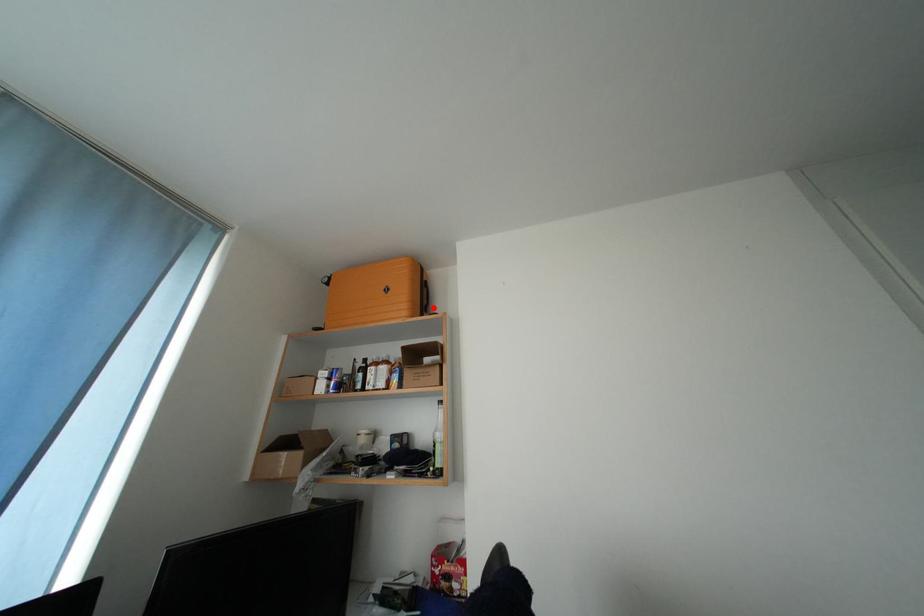
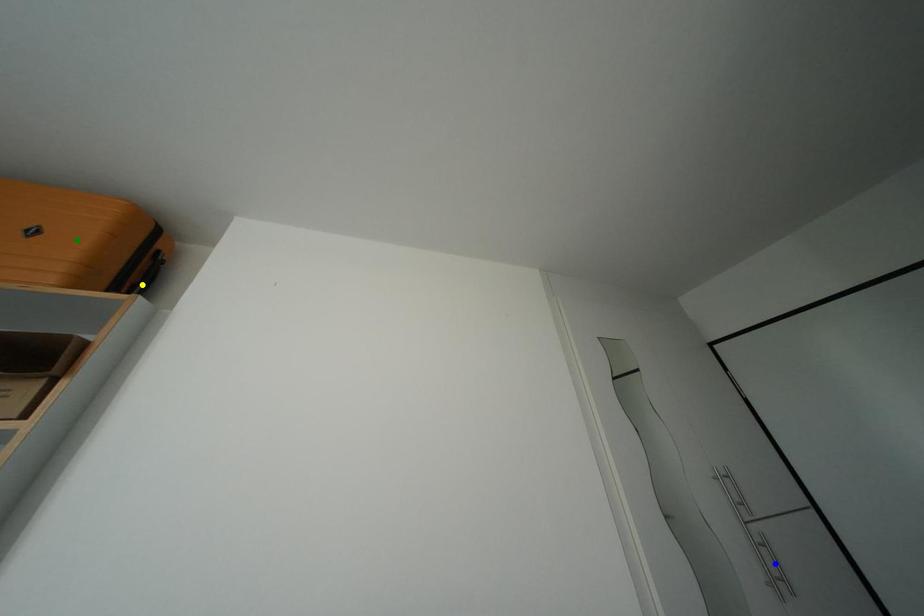
Question: I am providing you with two images of the same scene from different viewpoints. A red point is marked on the first image. You are given multiple points on the second image. Can you choose the point in image 2 that corresponds to the point in image 1?

Choices:
 (A) blue point
 (B) green point
 (C) yellow point

Answer: (C)